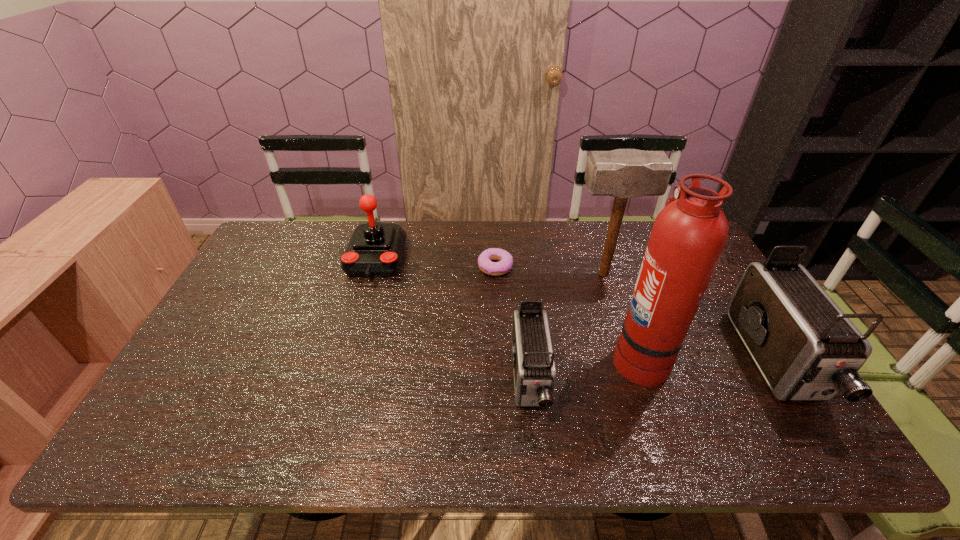
You are a GUI agent. You are given a task and a screenshot of the screen. Output one action in this format:
    pyautogui.click(x=<x>, y=<y>)
    Task: Click on the fifth tallest object
    
    Given the screenshot: What is the action you would take?
    pyautogui.click(x=534, y=369)

This screenshot has width=960, height=540. In order to click on the left camcorder in this screenshot , I will do `click(534, 369)`.

Image resolution: width=960 pixels, height=540 pixels. Identify the location of the right camcorder. click(807, 349).

This screenshot has width=960, height=540. In order to click on the third tallest object in this screenshot , I will do `click(807, 349)`.

Identify the location of the fourth tallest object. (375, 250).

You are a GUI agent. You are given a task and a screenshot of the screen. Output one action in this format:
    pyautogui.click(x=<x>, y=<y>)
    Task: Click on the joystick
    The height and width of the screenshot is (540, 960).
    Given the screenshot: What is the action you would take?
    pyautogui.click(x=375, y=250)

I want to click on the fifth shortest object, so click(x=622, y=173).

Image resolution: width=960 pixels, height=540 pixels. Find the location of `doughnut`. doughnut is located at coordinates click(485, 264).

Locate an element on the screen. This screenshot has width=960, height=540. the tallest object is located at coordinates (688, 237).

Where is `free space located on the base of the leftmost object`? The image size is (960, 540). free space located on the base of the leftmost object is located at coordinates (354, 336).